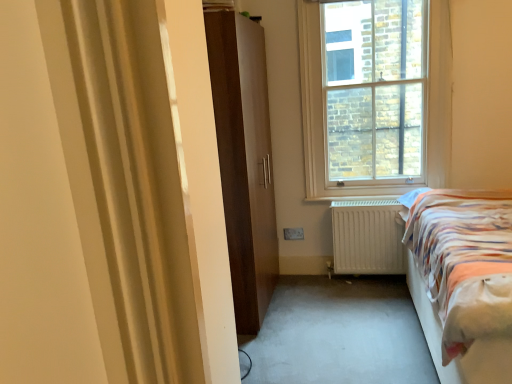
The image size is (512, 384). I want to click on clear glass window at upper center, so click(321, 114).

This screenshot has width=512, height=384. What do you see at coordinates (321, 114) in the screenshot?
I see `clear glass window at upper center` at bounding box center [321, 114].

The height and width of the screenshot is (384, 512). Find the location of `white matte radiator at lower center`. white matte radiator at lower center is located at coordinates (367, 237).

Locate an element on the screen. striped fabric bed at right is located at coordinates (464, 280).

Is striped fabric bed at right to the left of matte brown wardrobe at center from the viewer's perspective?

No.

Which of these two, striped fabric bed at right or matte brown wardrobe at center, is wider?

With larger width is striped fabric bed at right.

Is striped fabric bed at right not within matte brown wardrobe at center?

Yes, striped fabric bed at right is outside of matte brown wardrobe at center.

Is clear glass window at upper center beside white matte radiator at lower center?

No, clear glass window at upper center is not in contact with white matte radiator at lower center.

From a real-world perspective, between clear glass window at upper center and white matte radiator at lower center, who is vertically lower?

In real-world perspective, white matte radiator at lower center is lower.

You are a GUI agent. You are given a task and a screenshot of the screen. Output one action in this format:
    pyautogui.click(x=<x>, y=<y>)
    Task: Click on the window in front of the white matte radiator at lower center
    
    Given the screenshot: What is the action you would take?
    pos(321,114)

Is clear glass window at upper center positioned beyond the bounds of striped fabric bed at right?

Yes.

How many degrees apart are the facing directions of clear glass window at upper center and striped fabric bed at right?

The angular difference between clear glass window at upper center and striped fabric bed at right is 89.2 degrees.

Could you tell me if clear glass window at upper center is facing striped fabric bed at right?

Yes, clear glass window at upper center is aimed at striped fabric bed at right.

Considering the points (364, 248) and (317, 30), which point is behind, point (364, 248) or point (317, 30)?

Point (364, 248)

Which object is further away from the camera taking this photo, white matte radiator at lower center or clear glass window at upper center?

white matte radiator at lower center.

From a real-world perspective, relative to clear glass window at upper center, is white matte radiator at lower center vertically above or below?

white matte radiator at lower center is situated lower than clear glass window at upper center in the real world.

Does white matte radiator at lower center have a greater width compared to clear glass window at upper center?

Indeed, white matte radiator at lower center has a greater width compared to clear glass window at upper center.

Considering their positions, is matte brown wardrobe at center located in front of or behind white matte radiator at lower center?

matte brown wardrobe at center is in front of white matte radiator at lower center.

Identify the location of door in front of the white matte radiator at lower center. (244, 161).

Are matte brown wardrobe at center and white matte radiator at lower center making contact?

They are not placed beside each other.

From the image's perspective, between matte brown wardrobe at center and white matte radiator at lower center, which one is located above?

From the image's view, matte brown wardrobe at center is above.

At what (x,y) coordinates should I click in order to perform the action: click on door lying above the white matte radiator at lower center (from the image's perspective). Please return your answer as a coordinate pair (x, y). Looking at the image, I should click on (244, 161).

From a real-world perspective, is white matte radiator at lower center located beneath matte brown wardrobe at center?

Yes.

Is matte brown wardrobe at center surrounded by white matte radiator at lower center?

Actually, matte brown wardrobe at center is outside white matte radiator at lower center.

Does point (383, 246) appear closer or farther from the camera than point (225, 192)?

Point (383, 246).

Between striped fabric bed at right and white matte radiator at lower center, which one has less height?

Standing shorter between the two is white matte radiator at lower center.

Is striped fabric bed at right wider or thinner than white matte radiator at lower center?

striped fabric bed at right is wider than white matte radiator at lower center.

From a real-world perspective, is striped fabric bed at right below white matte radiator at lower center?

No.

Find the location of a particular element. bed in front of the matte brown wardrobe at center is located at coordinates (464, 280).

The image size is (512, 384). In the image, there is a clear glass window at upper center. In order to click on radiator below it (from the image's perspective) in this screenshot , I will do 367,237.

Which object lies nearer to the anchor point striped fabric bed at right, clear glass window at upper center or matte brown wardrobe at center?

Among the two, clear glass window at upper center is located nearer to striped fabric bed at right.

When comparing their distances from striped fabric bed at right, does clear glass window at upper center or white matte radiator at lower center seem further?

Based on the image, clear glass window at upper center appears to be further to striped fabric bed at right.

Looking at the image, which one is located closer to striped fabric bed at right, matte brown wardrobe at center or clear glass window at upper center?

clear glass window at upper center.

Estimate the real-world distances between objects in this image. Which object is further from matte brown wardrobe at center, striped fabric bed at right or white matte radiator at lower center?

The object further to matte brown wardrobe at center is striped fabric bed at right.

Looking at the image, which one is located closer to clear glass window at upper center, matte brown wardrobe at center or white matte radiator at lower center?

Based on the image, white matte radiator at lower center appears to be nearer to clear glass window at upper center.

Based on the photo, considering their positions, is matte brown wardrobe at center positioned closer to white matte radiator at lower center than clear glass window at upper center?

clear glass window at upper center lies closer to white matte radiator at lower center than the other object.

Consider the image. Considering their positions, is white matte radiator at lower center positioned closer to matte brown wardrobe at center than striped fabric bed at right?

Among the two, white matte radiator at lower center is located nearer to matte brown wardrobe at center.

Considering their positions, is white matte radiator at lower center positioned closer to striped fabric bed at right than clear glass window at upper center?

The object closer to striped fabric bed at right is white matte radiator at lower center.

This screenshot has width=512, height=384. I want to click on window between matte brown wardrobe at center and white matte radiator at lower center from left to right, so click(x=321, y=114).

Identify the location of door located between striped fabric bed at right and white matte radiator at lower center in the depth direction. (244, 161).

Where is `door between striped fabric bed at right and clear glass window at upper center from front to back`? door between striped fabric bed at right and clear glass window at upper center from front to back is located at coordinates (244, 161).

In order to click on window between striped fabric bed at right and white matte radiator at lower center along the z-axis in this screenshot , I will do `click(321, 114)`.